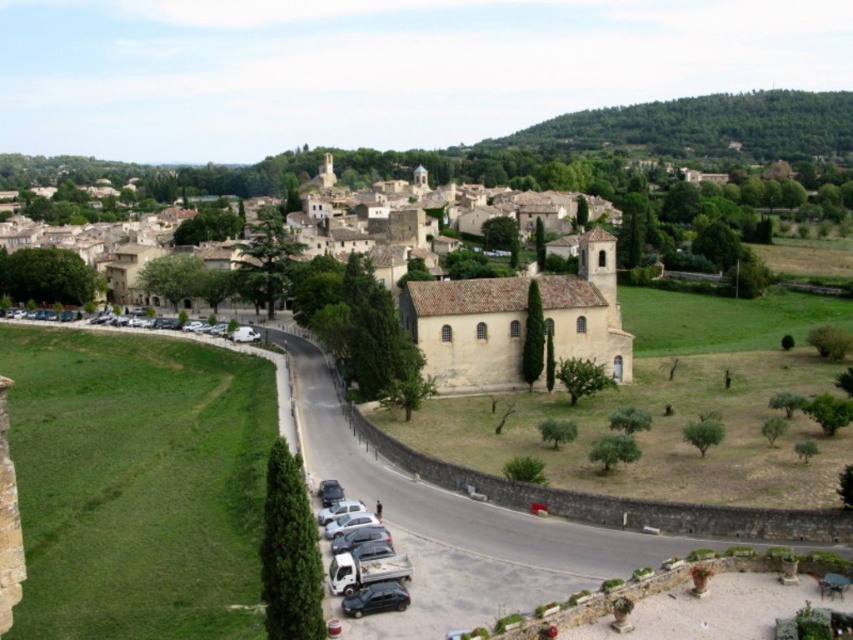
You are a photographer planning to take a landscape photo of the yellow stone church at center and the metallic silver truck at lower center. You want to ensure both are in focus. Given that the depth of field can only cover objects within a 3 meter height difference, will both objects be in focus?

The yellow stone church at center is much taller than the metallic silver truck at lower center. However, without specific height measurements, it is impossible to determine if their height difference is within the 3 meter depth of field limit. Additional information about their exact heights is needed to answer this.

Looking at this image, you are a photographer planning to take a photo of the yellow stone church at center and the metallic silver truck at lower center. Which object should you focus on first if you want to include both in your shot without moving the camera?

The yellow stone church at center is bigger than the metallic silver truck at lower center, so you should focus on the yellow stone church at center first to ensure it fits properly in the frame before adjusting for the smaller truck.

You are a tourist standing at the entrance of the visitor center. You want to take a photo of the yellow stone church at center and the green leafy hillside at upper right in the same frame. Which direction should you face to ensure both are visible?

You should face upward because the yellow stone church at center is located below the green leafy hillside at upper right, so facing upward will allow both to be in the same frame.